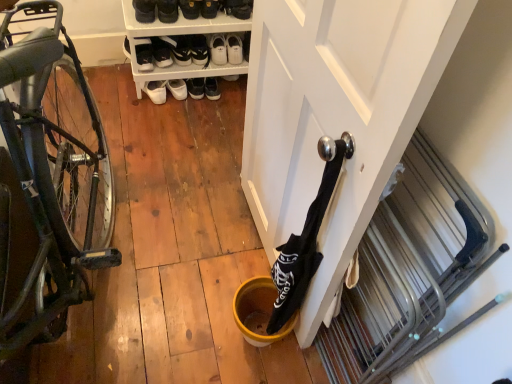
Describe the element at coordinates (234, 49) in the screenshot. The height and width of the screenshot is (384, 512). I see `white leather sneakers at upper center, arranged as the sixth footwear when viewed from the left` at that location.

Measure the distance between black fabric wine bottle at center and camera.

A distance of 31.24 inches exists between black fabric wine bottle at center and camera.

Measure the distance between point (276, 328) and camera.

The depth of point (276, 328) is 1.36 meters.

Describe the element at coordinates (53, 174) in the screenshot. I see `shiny black bicycle at left` at that location.

Measure the distance between point (173, 49) and camera.

Point (173, 49) and camera are 2.16 meters apart.

This screenshot has width=512, height=384. What are the coordinates of `yellow matte bucket at lower center` in the screenshot? It's located at (170, 255).

Based on the photo, how much distance is there between white matte door at center and white leather shoes at center, marked as the sixth footwear in a right-to-left arrangement?

white matte door at center is 4.12 feet from white leather shoes at center, marked as the sixth footwear in a right-to-left arrangement.

Is white matte door at center positioned beyond the bounds of white leather shoes at center, marked as the sixth footwear in a right-to-left arrangement?

Yes.

Find the location of a particular element. Image resolution: width=512 pixels, height=384 pixels. door in front of the white leather shoes at center, marked as the sixth footwear in a right-to-left arrangement is located at coordinates (336, 114).

From the image's perspective, which is below, white matte door at center or white leather shoes at center, marked as the sixth footwear in a right-to-left arrangement?

white matte door at center, from the image's perspective.

From a real-world perspective, is white leather shoe at upper center, which is counted as the second shoe, starting from the right, positioned above or below white plastic shoe rack at upper center?

Clearly, from a real-world perspective, white leather shoe at upper center, which is counted as the second shoe, starting from the right, is above white plastic shoe rack at upper center.

Is point (187, 4) in front of point (157, 20)?

Yes, it is.

Is white leather shoe at upper center, the 1th shoe when ordered from left to right, further to camera compared to white plastic shoe rack at upper center?

That is True.

From the image's perspective, who appears lower, white leather shoes at center, which is counted as the first footwear, starting from the left, or white leather sneakers at upper center, the third footwear when ordered from right to left?

From the image's view, white leather shoes at center, which is counted as the first footwear, starting from the left, is below.

Is white leather shoes at center, which is counted as the first footwear, starting from the left, in contact with white leather sneakers at upper center, arranged as the fourth footwear when viewed from the left?

white leather shoes at center, which is counted as the first footwear, starting from the left, and white leather sneakers at upper center, arranged as the fourth footwear when viewed from the left, are not in contact.

Which of these two, white leather shoes at center, marked as the sixth footwear in a right-to-left arrangement, or white leather sneakers at upper center, the third footwear when ordered from right to left, is wider?

Result: Wider between the two is white leather sneakers at upper center, the third footwear when ordered from right to left.

Does white plastic shoe rack at upper center come behind yellow matte bucket at lower center?

Yes, it is behind yellow matte bucket at lower center.

The width and height of the screenshot is (512, 384). I want to click on shelf that is above the yellow matte bucket at lower center (from the image's perspective), so click(181, 34).

Considering the sizes of objects white plastic shoe rack at upper center and yellow matte bucket at lower center in the image provided, who is shorter, white plastic shoe rack at upper center or yellow matte bucket at lower center?

With less height is yellow matte bucket at lower center.

Which of these two, shiny black bicycle at left or black suede shoes at upper center, the second footwear in the left-to-right sequence, is wider?

Wider between the two is shiny black bicycle at left.

Is shiny black bicycle at left next to black suede shoes at upper center, the 5th footwear from the right?

No.

Is shiny black bicycle at left completely or partially outside of black suede shoes at upper center, the second footwear in the left-to-right sequence?

Yes, shiny black bicycle at left is outside of black suede shoes at upper center, the second footwear in the left-to-right sequence.

Is point (28, 204) positioned after point (144, 18)?

No, (28, 204) is in front of (144, 18).

Can you confirm if white leather shoe at upper center, which is counted as the second shoe, starting from the right, is shorter than shiny black bicycle at left?

Yes, white leather shoe at upper center, which is counted as the second shoe, starting from the right, is shorter than shiny black bicycle at left.

Between white leather shoe at upper center, which is counted as the second shoe, starting from the right, and shiny black bicycle at left, which one has larger width?

shiny black bicycle at left is wider.

At what (x,y) coordinates should I click in order to perform the action: click on bicycle below the white leather shoe at upper center, the 1th shoe when ordered from left to right (from the image's perspective). Please return your answer as a coordinate pair (x, y). Looking at the image, I should click on (53, 174).

How far apart are white leather sneakers at upper center, which is counted as the 2th footwear, starting from the right, and white leather shoes at center, marked as the sixth footwear in a right-to-left arrangement?

white leather sneakers at upper center, which is counted as the 2th footwear, starting from the right, is 9.42 inches away from white leather shoes at center, marked as the sixth footwear in a right-to-left arrangement.

From the image's perspective, is white leather sneakers at upper center, which is counted as the 2th footwear, starting from the right, located above or below white leather shoes at center, marked as the sixth footwear in a right-to-left arrangement?

Based on their image positions, white leather sneakers at upper center, which is counted as the 2th footwear, starting from the right, is located above white leather shoes at center, marked as the sixth footwear in a right-to-left arrangement.

Is white leather sneakers at upper center, placed as the fifth footwear when sorted from left to right, in front of white leather shoes at center, marked as the sixth footwear in a right-to-left arrangement?

No, white leather sneakers at upper center, placed as the fifth footwear when sorted from left to right, is behind white leather shoes at center, marked as the sixth footwear in a right-to-left arrangement.

Considering the relative positions of white leather sneakers at upper center, which is counted as the 2th footwear, starting from the right, and white leather shoes at center, which is counted as the first footwear, starting from the left, in the image provided, is white leather sneakers at upper center, which is counted as the 2th footwear, starting from the right, to the left of white leather shoes at center, which is counted as the first footwear, starting from the left, from the viewer's perspective?

No.

The height and width of the screenshot is (384, 512). Find the location of `door below the white leather shoes at center, marked as the sixth footwear in a right-to-left arrangement (from the image's perspective)`. door below the white leather shoes at center, marked as the sixth footwear in a right-to-left arrangement (from the image's perspective) is located at coordinates (336, 114).

From the image's perspective, starting from the white plastic shoe rack at upper center, which shoe is the 1st one above? Please provide its 2D coordinates.

[(190, 8)]

Which object lies further to the anchor point white plastic shoe rack at upper center, white leather shoes at center, marked as the sixth footwear in a right-to-left arrangement, or white matte door at center?

white matte door at center is positioned further to the anchor white plastic shoe rack at upper center.

Considering their positions, is white matte door at center positioned closer to black fabric wine bottle at center than black suede shoes at upper center, the second footwear in the left-to-right sequence?

Based on the image, white matte door at center appears to be nearer to black fabric wine bottle at center.

Which object lies further to the anchor point white leather sneakers at upper center, placed as the fifth footwear when sorted from left to right, white leather shoes at center, which is counted as the first footwear, starting from the left, or white leather shoe at upper center, positioned as the 1th shoe in right-to-left order?

The object further to white leather sneakers at upper center, placed as the fifth footwear when sorted from left to right, is white leather shoes at center, which is counted as the first footwear, starting from the left.

Considering their positions, is white leather sneakers at upper center, the third footwear when ordered from right to left, positioned further to white plastic shoe rack at upper center than black fabric wine bottle at center?

Based on the image, black fabric wine bottle at center appears to be further to white plastic shoe rack at upper center.

From the image, which object appears to be nearer to white leather sneakers at upper center, which is counted as the 2th footwear, starting from the right, black suede shoes at upper center, the second footwear in the left-to-right sequence, or white matte door at center?

black suede shoes at upper center, the second footwear in the left-to-right sequence, lies closer to white leather sneakers at upper center, which is counted as the 2th footwear, starting from the right, than the other object.

Based on their spatial positions, is white leather sneakers at upper center, arranged as the sixth footwear when viewed from the left, or black suede shoe at upper center, the 4th footwear in the right-to-left sequence, further from black suede shoes at upper center, the 5th footwear from the right?

Based on the image, white leather sneakers at upper center, arranged as the sixth footwear when viewed from the left, appears to be further to black suede shoes at upper center, the 5th footwear from the right.

Considering their positions, is white plastic shoe rack at upper center positioned closer to white leather sneakers at upper center, which is counted as the 2th footwear, starting from the right, than white leather shoe at upper center, which is counted as the second shoe, starting from the right?

white plastic shoe rack at upper center is closer to white leather sneakers at upper center, which is counted as the 2th footwear, starting from the right.

Looking at the image, which one is located closer to white leather shoe at upper center, which is counted as the second shoe, starting from the right, white leather sneakers at upper center, arranged as the sixth footwear when viewed from the left, or black suede shoe at upper center, the 4th footwear in the right-to-left sequence?

black suede shoe at upper center, the 4th footwear in the right-to-left sequence, lies closer to white leather shoe at upper center, which is counted as the second shoe, starting from the right, than the other object.

The image size is (512, 384). Identify the location of shelf between white leather sneakers at upper center, placed as the fifth footwear when sorted from left to right, and yellow matte bucket at lower center, in the vertical direction. (181, 34).

Find the location of a particular element. shelf that lies between black suede shoes at upper center, the 5th footwear from the right, and yellow matte bucket at lower center from top to bottom is located at coordinates (181, 34).

Locate an element on the screen. This screenshot has height=384, width=512. wine bottle between white matte door at center and white leather sneakers at upper center, arranged as the first footwear when viewed from the right, in the front-back direction is located at coordinates (306, 237).

Locate an element on the screen. The image size is (512, 384). wine bottle between shiny black bicycle at left and white leather shoes at center, marked as the sixth footwear in a right-to-left arrangement, from front to back is located at coordinates (306, 237).